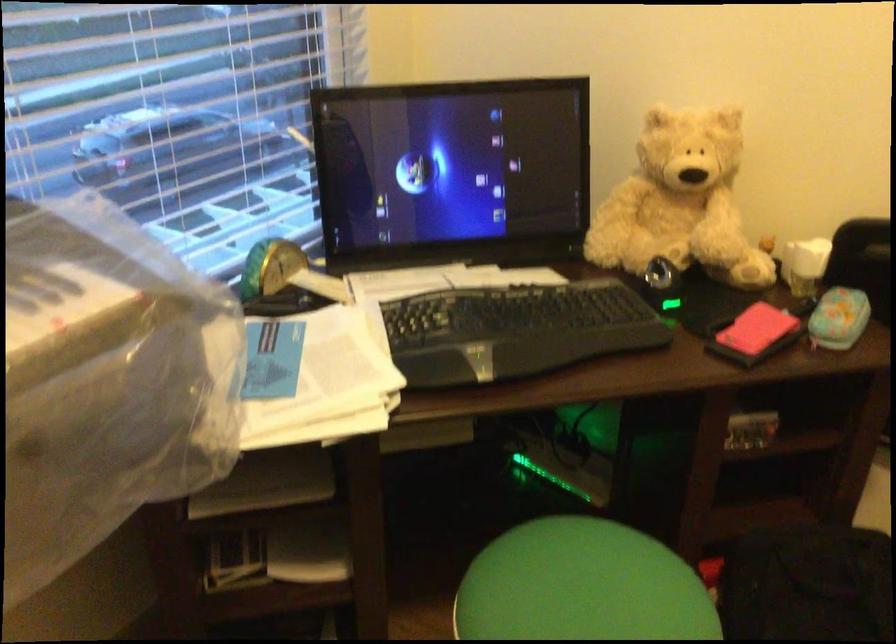
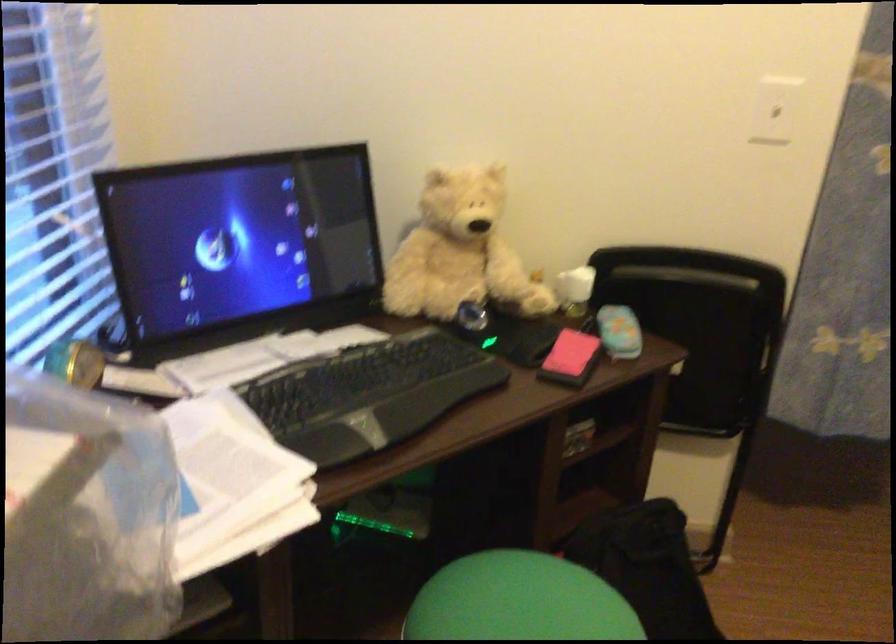
Question: In a continuous first-person perspective shot, in which direction is the camera moving?

Choices:
 (A) Left
 (B) Right
 (C) Forward
 (D) Backward

Answer: (A)